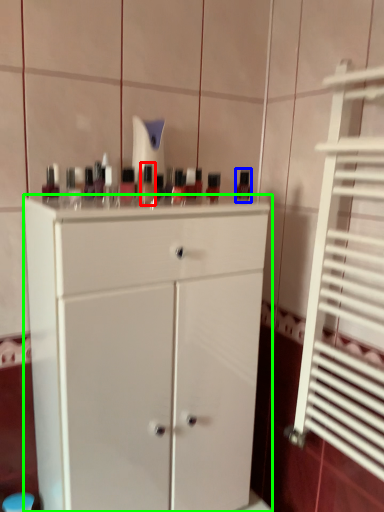
Question: Based on their relative distances, which object is nearer to mouthwash (highlighted by a red box)? Choose from mouthwash (highlighted by a blue box) and chest of drawers (highlighted by a green box).

Choices:
 (A) mouthwash
 (B) chest of drawers

Answer: (B)